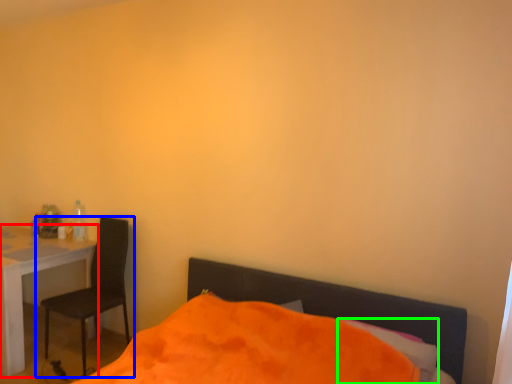
Question: Which object is the farthest from desk (highlighted by a red box)? Choose among these: chair (highlighted by a blue box) or pillow (highlighted by a green box).

Choices:
 (A) chair
 (B) pillow

Answer: (B)